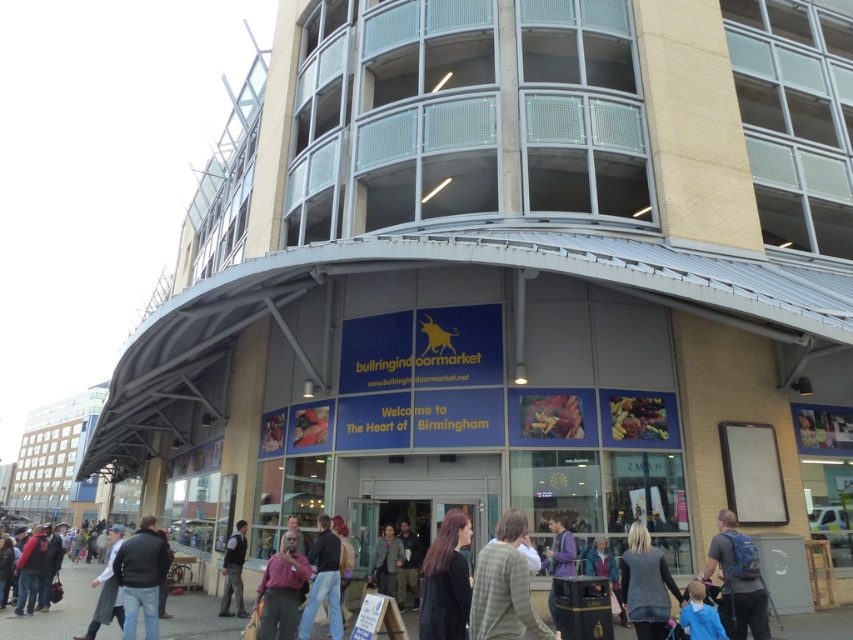
Can you confirm if dark gray sweater at lower center is wider than dark gray wool coat at center?

Yes, dark gray sweater at lower center is wider than dark gray wool coat at center.

Between point (631, 589) and point (386, 538), which one is positioned behind?

Positioned behind is point (386, 538).

Identify the location of dark gray sweater at lower center. (646, 584).

Does striped sweater at center have a greater width compared to dark gray sweater at lower center?

No, striped sweater at center is not wider than dark gray sweater at lower center.

Which is above, striped sweater at center or dark gray sweater at lower center?

striped sweater at center is above.

Is point (508, 577) farther from viewer compared to point (625, 592)?

No.

Locate an element on the screen. The width and height of the screenshot is (853, 640). striped sweater at center is located at coordinates (503, 586).

Is striped sweater at center positioned at the back of dark gray jacket at lower left?

No, it is not.

The width and height of the screenshot is (853, 640). I want to click on striped sweater at center, so click(503, 586).